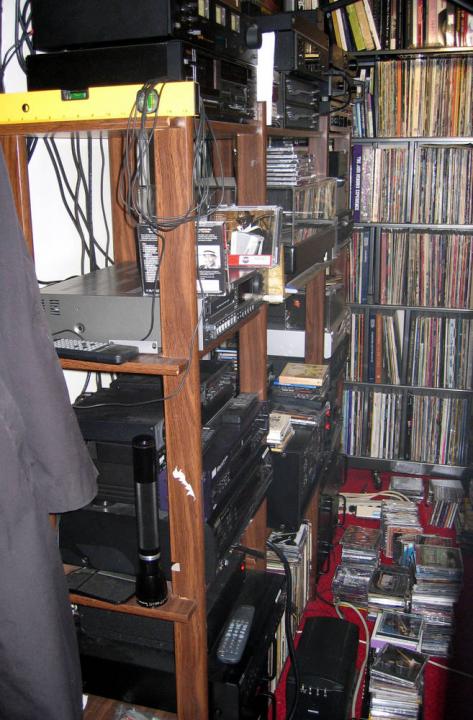
Where is `floor`? floor is located at coordinates (352, 484).